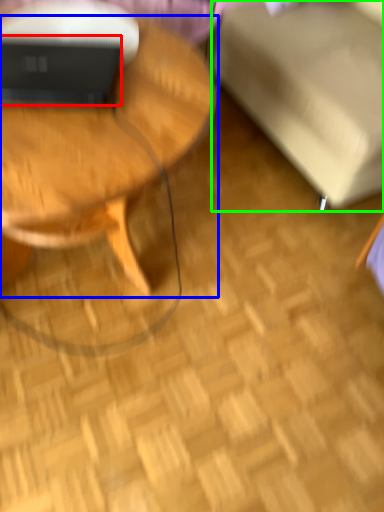
Question: Based on their relative distances, which object is farther from laptop (highlighted by a red box)? Choose from coffee table (highlighted by a blue box) and swivel chair (highlighted by a green box).

Choices:
 (A) coffee table
 (B) swivel chair

Answer: (B)